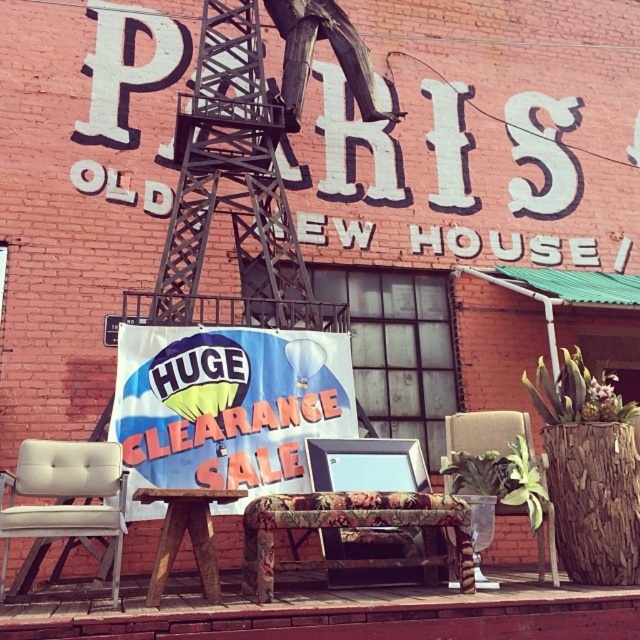
Question: Among these points, which one is farthest from the camera?

Choices:
 (A) (220, 3)
 (B) (20, 452)
 (C) (314, 499)
 (D) (480, 413)

Answer: (A)

Question: Does beige fabric chair at lower left come in front of wooden textured chair at center?

Choices:
 (A) no
 (B) yes

Answer: (B)

Question: Observing the image, what is the correct spatial positioning of beige fabric chair at lower left in reference to wooden stool at center?

Choices:
 (A) above
 (B) below

Answer: (B)

Question: Which of the following is the closest to the observer?

Choices:
 (A) blue fabric sign at center
 (B) beige fabric chair at lower left

Answer: (B)

Question: Which of the following is the closest to the observer?

Choices:
 (A) blue fabric sign at center
 (B) rusty metal crane at center
 (C) floral fabric chair at center
 (D) wooden stool at center

Answer: (D)

Question: Does blue fabric sign at center have a smaller size compared to wooden stool at center?

Choices:
 (A) yes
 (B) no

Answer: (B)